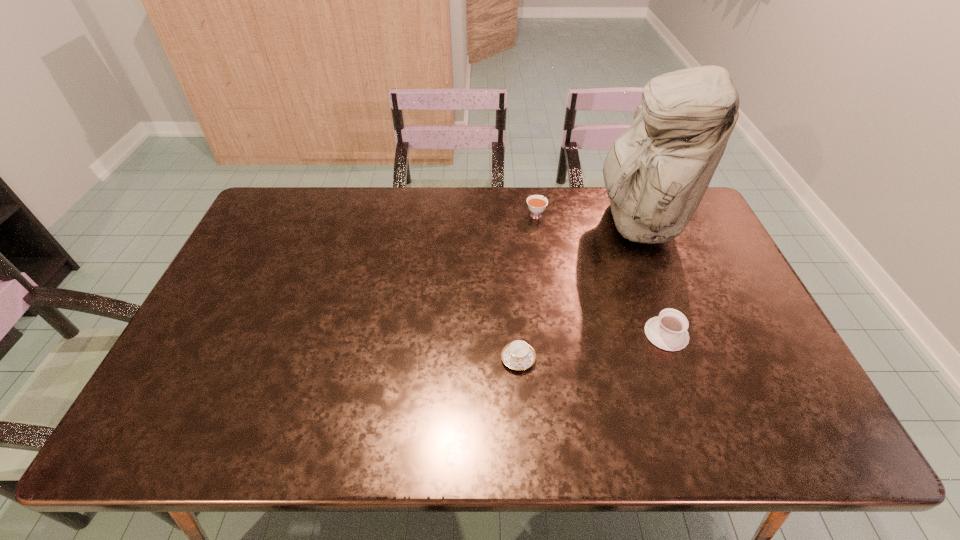
This screenshot has width=960, height=540. Find the location of `backpack`. backpack is located at coordinates (656, 173).

At what (x,y) coordinates should I click in order to perform the action: click on the second teacup from left to right. Please return your answer as a coordinate pair (x, y). The width and height of the screenshot is (960, 540). Looking at the image, I should click on (536, 204).

The width and height of the screenshot is (960, 540). Identify the location of the farthest teacup. [x=536, y=204].

Locate an element on the screen. The image size is (960, 540). the rightmost teacup is located at coordinates (668, 331).

I want to click on the leftmost teacup, so click(x=518, y=355).

The width and height of the screenshot is (960, 540). In order to click on the leftmost object in this screenshot , I will do tap(518, 355).

Find the location of a particular element. Image resolution: width=960 pixels, height=540 pixels. vacant space located on the front-facing side of the backpack is located at coordinates (540, 223).

Locate an element on the screen. vacant space situated 0.290m on the front-facing side of the backpack is located at coordinates (507, 223).

This screenshot has height=540, width=960. In order to click on vacant area situated on the front-facing side of the backpack in this screenshot , I will do `click(478, 223)`.

The height and width of the screenshot is (540, 960). I want to click on free space located on the side of the farthest teacup with the handle, so click(x=534, y=199).